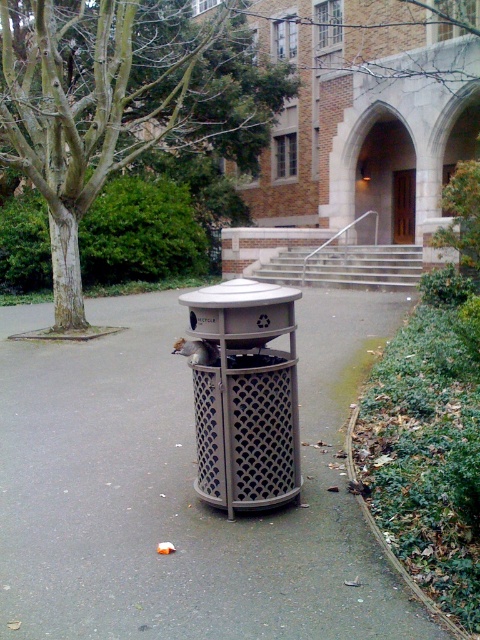
Question: Considering the relative positions of brushed metal trash can at center and green leafy tree at center in the image provided, where is brushed metal trash can at center located with respect to green leafy tree at center?

Choices:
 (A) above
 (B) below

Answer: (B)

Question: Does green leafy tree at center appear on the left side of metallic mesh trash can at center?

Choices:
 (A) yes
 (B) no

Answer: (A)

Question: Which point is farther to the camera?

Choices:
 (A) metallic mesh trash can at center
 (B) green leafy tree at center

Answer: (B)

Question: Is green leafy tree at center wider than metallic mesh trash can at center?

Choices:
 (A) no
 (B) yes

Answer: (B)

Question: Based on their relative distances, which object is farther from the green leafy tree at center?

Choices:
 (A) metallic mesh trash can at center
 (B) brushed metal trash can at center

Answer: (A)

Question: Which point is closer to the camera taking this photo?

Choices:
 (A) [191, 58]
 (B) [226, 388]
 (C) [137, 310]

Answer: (B)